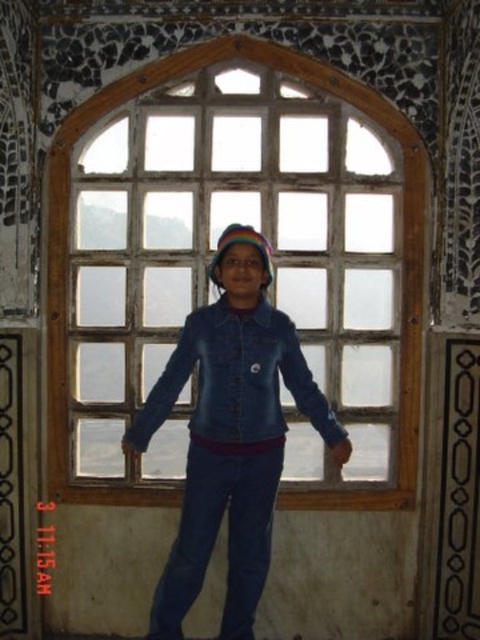
Question: Is wooden grid at center positioned at the back of denim jacket at center?

Choices:
 (A) yes
 (B) no

Answer: (A)

Question: Among these points, which one is farthest from the camera?

Choices:
 (A) (183, 548)
 (B) (276, 124)

Answer: (B)

Question: Does wooden grid at center appear over denim jacket at center?

Choices:
 (A) no
 (B) yes

Answer: (B)

Question: Considering the relative positions of wooden grid at center and denim jacket at center in the image provided, where is wooden grid at center located with respect to denim jacket at center?

Choices:
 (A) above
 (B) below

Answer: (A)